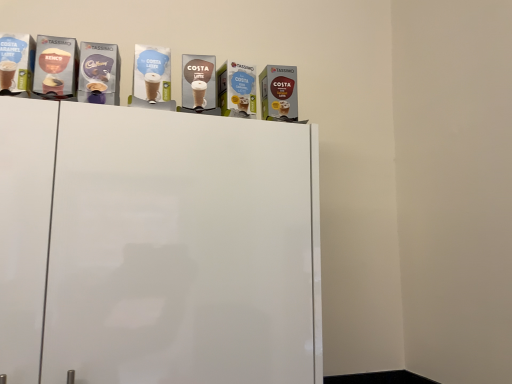
Identify the location of white matte cupboard at upper center. click(157, 246).

Describe the element at coordinates (157, 246) in the screenshot. I see `white matte cupboard at upper center` at that location.

Image resolution: width=512 pixels, height=384 pixels. Find the location of `white matte cupboard at upper center`. white matte cupboard at upper center is located at coordinates (157, 246).